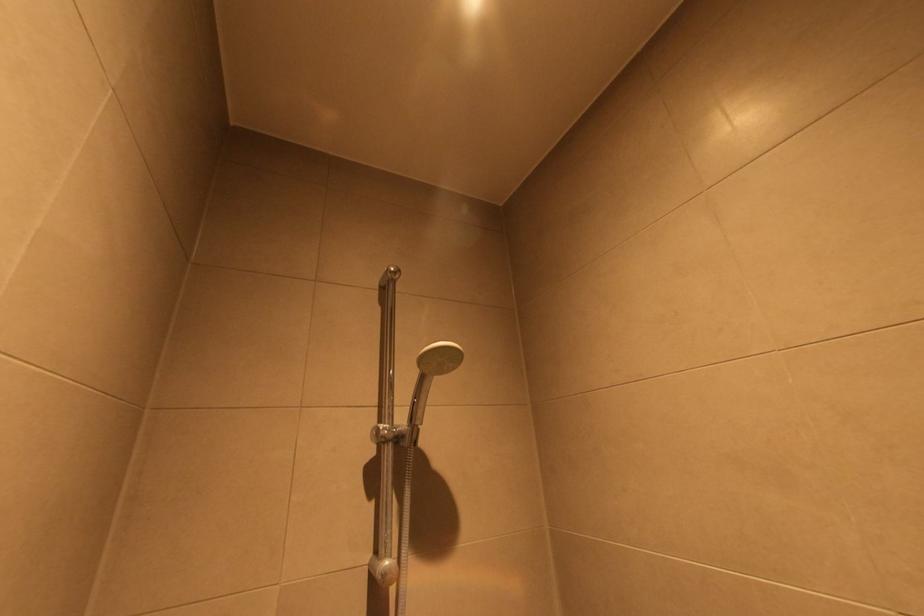
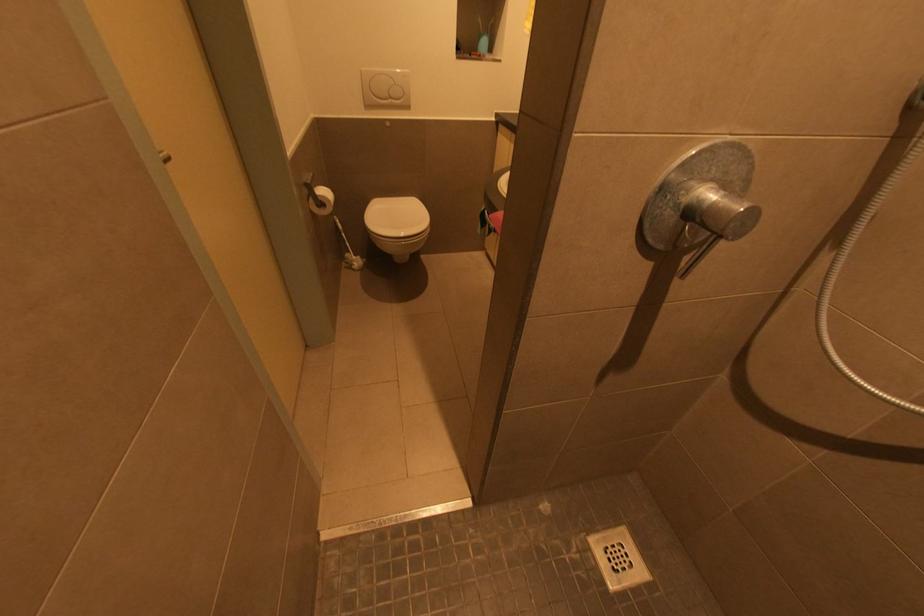
The first image is from the beginning of the video and the second image is from the end. How did the camera likely rotate when shooting the video?

The camera rotated toward left-down.